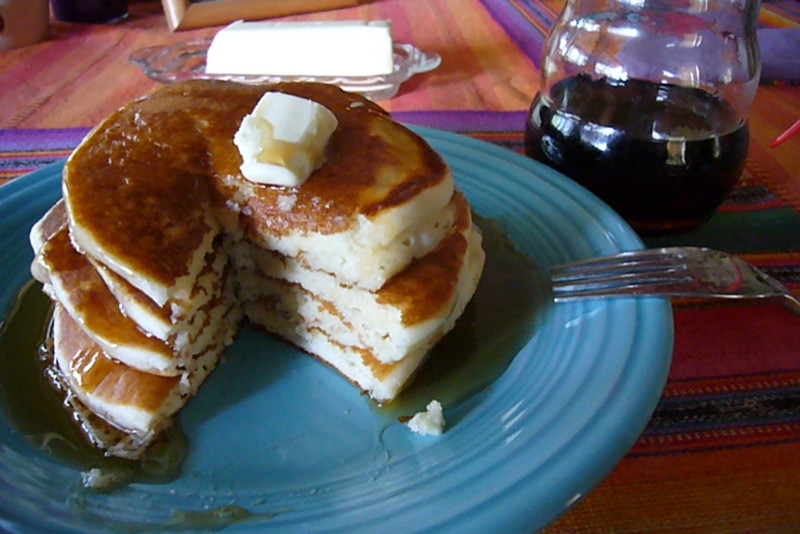
The width and height of the screenshot is (800, 534). Identify the location of glass pitcher. (650, 152).